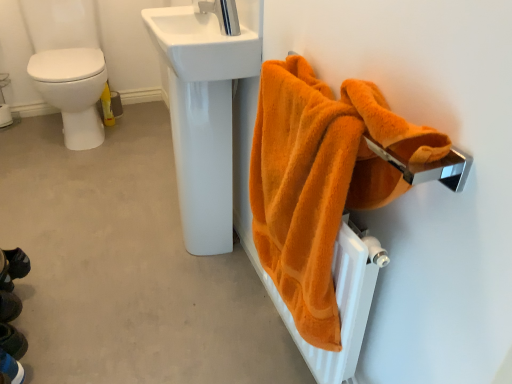
This screenshot has width=512, height=384. Identify the location of dark blue fabric shoes at lower left. (11, 316).

What is the approximate height of white glossy sink at upper center?

It is 12.37 centimeters.

The image size is (512, 384). In order to click on white glossy sink at upper center in this screenshot , I will do (x=201, y=45).

Identify the location of silver metallic tap at upper center. (x=221, y=14).

Is dark blue fabric shoes at lower left situated inside white glossy sink at upper center or outside?

dark blue fabric shoes at lower left lies outside white glossy sink at upper center.

Is dark blue fabric shoes at lower left closer to the viewer compared to white glossy sink at upper center?

Yes, dark blue fabric shoes at lower left is closer to the viewer.

Locate an element on the screen. sink above the dark blue fabric shoes at lower left (from the image's perspective) is located at coordinates (201, 45).

From the image's perspective, which one is positioned higher, orange fluffy towel at right or dark blue fabric shoes at lower left?

orange fluffy towel at right.

Is orange fluffy towel at right inside the boundaries of dark blue fabric shoes at lower left, or outside?

orange fluffy towel at right is spatially situated outside dark blue fabric shoes at lower left.

Who is more distant, orange fluffy towel at right or dark blue fabric shoes at lower left?

dark blue fabric shoes at lower left.

From a real-world perspective, does orange fluffy towel at right stand above silver metallic tap at upper center?

No, from a real-world perspective, orange fluffy towel at right is not over silver metallic tap at upper center

Identify the location of towel lying below the silver metallic tap at upper center (from the image's perspective). The image size is (512, 384). (320, 180).

Considering the relative sizes of orange fluffy towel at right and white leather shoe at lower left in the image provided, is orange fluffy towel at right bigger than white leather shoe at lower left?

Yes.

This screenshot has height=384, width=512. In order to click on towel above the white leather shoe at lower left (from the image's perspective) in this screenshot , I will do `click(320, 180)`.

From a real-world perspective, is orange fluffy towel at right physically above white leather shoe at lower left?

Correct, in the physical world, orange fluffy towel at right is higher than white leather shoe at lower left.

Can you confirm if orange fluffy towel at right is thinner than white leather shoe at lower left?

Incorrect, the width of orange fluffy towel at right is not less than that of white leather shoe at lower left.

From the image's perspective, is dark blue fabric shoes at lower left above orange fluffy towel at right?

Incorrect, from the image's perspective, dark blue fabric shoes at lower left is lower than orange fluffy towel at right.

Is dark blue fabric shoes at lower left wider than orange fluffy towel at right?

Yes, dark blue fabric shoes at lower left is wider than orange fluffy towel at right.

Is dark blue fabric shoes at lower left in contact with orange fluffy towel at right?

No.

Looking at this image, is dark blue fabric shoes at lower left positioned with its back to orange fluffy towel at right?

No, dark blue fabric shoes at lower left is not facing away from orange fluffy towel at right.

Where is `squat above the white leather shoe at lower left (from the image's perspective)`? The height and width of the screenshot is (384, 512). squat above the white leather shoe at lower left (from the image's perspective) is located at coordinates (11, 316).

Is white leather shoe at lower left at the left side of dark blue fabric shoes at lower left?

No, white leather shoe at lower left is not to the left of dark blue fabric shoes at lower left.

Considering the sizes of white leather shoe at lower left and dark blue fabric shoes at lower left in the image, is white leather shoe at lower left wider or thinner than dark blue fabric shoes at lower left?

white leather shoe at lower left is thinner than dark blue fabric shoes at lower left.

Between white leather shoe at lower left and dark blue fabric shoes at lower left, which one has less height?

white leather shoe at lower left is shorter.

Considering the sizes of objects silver metallic tap at upper center and dark blue fabric shoes at lower left in the image provided, who is wider, silver metallic tap at upper center or dark blue fabric shoes at lower left?

With larger width is dark blue fabric shoes at lower left.

From the picture: Is silver metallic tap at upper center inside the boundaries of dark blue fabric shoes at lower left, or outside?

silver metallic tap at upper center cannot be found inside dark blue fabric shoes at lower left.

Considering the positions of objects silver metallic tap at upper center and dark blue fabric shoes at lower left in the image provided, who is more to the right, silver metallic tap at upper center or dark blue fabric shoes at lower left?

silver metallic tap at upper center.

From the image's perspective, which one is positioned higher, silver metallic tap at upper center or dark blue fabric shoes at lower left?

silver metallic tap at upper center.

The width and height of the screenshot is (512, 384). I want to click on sink above the dark blue fabric shoes at lower left (from the image's perspective), so click(x=201, y=45).

Locate an element on the screen. This screenshot has width=512, height=384. squat located behind the orange fluffy towel at right is located at coordinates (11, 316).

Considering their positions, is white glossy sink at upper center positioned further to white leather shoe at lower left than silver metallic tap at upper center?

silver metallic tap at upper center is further to white leather shoe at lower left.

Based on their spatial positions, is white leather shoe at lower left or orange fluffy towel at right further from silver metallic tap at upper center?

The object further to silver metallic tap at upper center is white leather shoe at lower left.

Considering their positions, is dark blue fabric shoes at lower left positioned closer to white leather shoe at lower left than silver metallic tap at upper center?

Based on the image, dark blue fabric shoes at lower left appears to be nearer to white leather shoe at lower left.

When comparing their distances from orange fluffy towel at right, does silver metallic tap at upper center or white leather shoe at lower left seem closer?

The object closer to orange fluffy towel at right is silver metallic tap at upper center.

Which object lies nearer to the anchor point orange fluffy towel at right, silver metallic tap at upper center or dark blue fabric shoes at lower left?

silver metallic tap at upper center is positioned closer to the anchor orange fluffy towel at right.

Consider the image. From the image, which object appears to be nearer to dark blue fabric shoes at lower left, silver metallic tap at upper center or white leather shoe at lower left?

Among the two, white leather shoe at lower left is located nearer to dark blue fabric shoes at lower left.

Looking at the image, which one is located closer to dark blue fabric shoes at lower left, orange fluffy towel at right or silver metallic tap at upper center?

Among the two, orange fluffy towel at right is located nearer to dark blue fabric shoes at lower left.

Considering their positions, is white leather shoe at lower left positioned further to silver metallic tap at upper center than dark blue fabric shoes at lower left?

Among the two, dark blue fabric shoes at lower left is located further to silver metallic tap at upper center.

This screenshot has height=384, width=512. I want to click on tap between dark blue fabric shoes at lower left and orange fluffy towel at right, so (221, 14).

The image size is (512, 384). Identify the location of shoe between dark blue fabric shoes at lower left and orange fluffy towel at right from left to right. (11, 368).

This screenshot has height=384, width=512. In order to click on towel between white glossy sink at upper center and white leather shoe at lower left in the up-down direction in this screenshot , I will do `click(320, 180)`.

Find the location of a particular element. This screenshot has width=512, height=384. sink between silver metallic tap at upper center and white leather shoe at lower left from top to bottom is located at coordinates (201, 45).